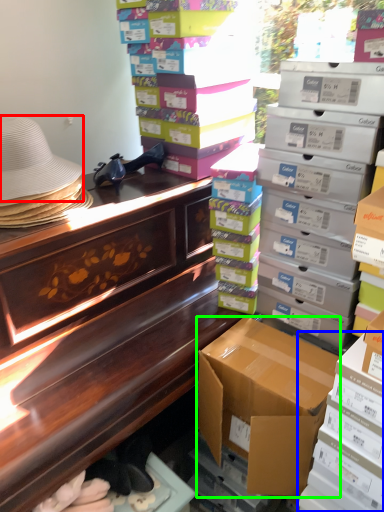
Question: Which object is the closest to the hat (highlighted by a red box)? Choose among these: box (highlighted by a blue box) or box (highlighted by a green box).

Choices:
 (A) box
 (B) box

Answer: (B)